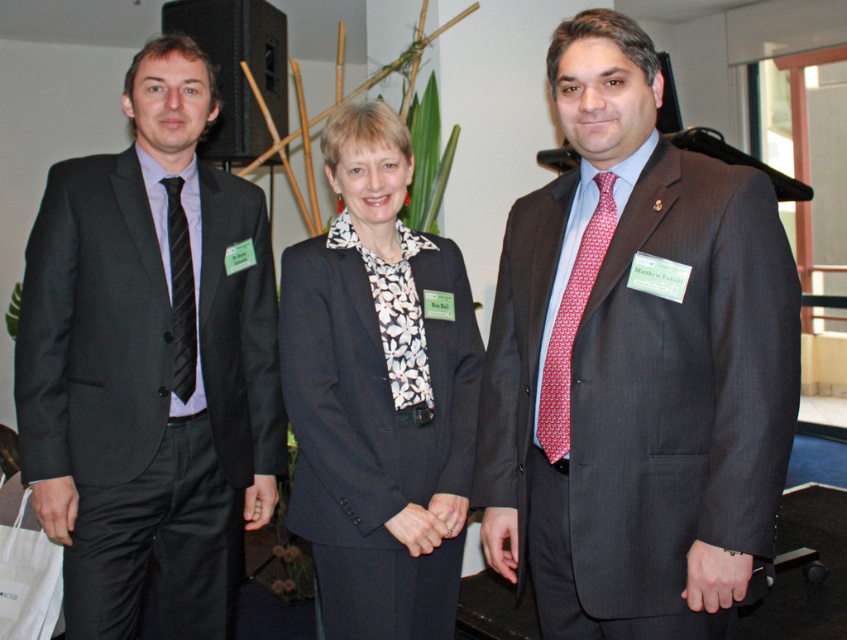
You are standing at the point marked as point (645, 92). You need to reach a door that is 4.73 feet away from your current position. Can you safely walk straight to the door without any obstacles?

Yes, since the distance between you and the door is exactly 4.73 feet, which matches the distance specified, so there are no obstacles in your path.

You are a photographer at a conference and need to ensure that all participants are visible in a group photo. You notice the matte gray suit at center and the black striped tie at left. Which object is positioned higher in the image?

The matte gray suit at center is much taller than the black striped tie at left, so the matte gray suit at center is positioned higher in the image.

You are standing in the room and want to know which of the two points, point (x=657, y=636) or point (x=169, y=179), is nearer to you. Can you determine this based on the scene?

Point (x=657, y=636) is closer to the camera than point (x=169, y=179), so it is nearer to you.